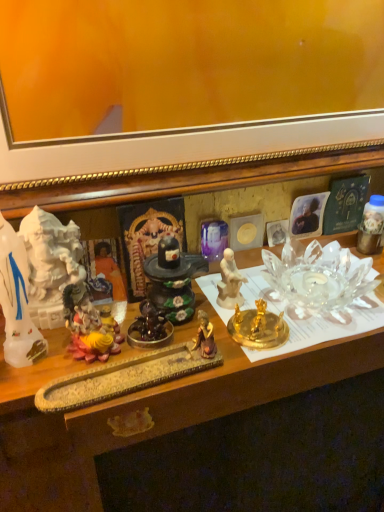
The image size is (384, 512). What are the coordinates of `unoccupied area in front of orange fabric at center, which is the 2th person in right-to-left order` in the screenshot? It's located at (92, 367).